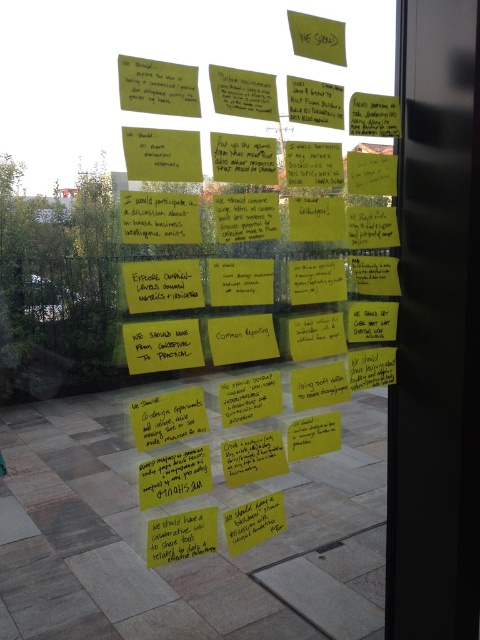
Question: Which point appears closest to the camera in this image?

Choices:
 (A) (410, 324)
 (B) (310, 228)

Answer: (B)

Question: Is yellow sticky notes at upper center above yellow sticky notes at right?

Choices:
 (A) no
 (B) yes

Answer: (B)

Question: Is yellow sticky notes at upper center further to the viewer compared to yellow sticky notes at right?

Choices:
 (A) yes
 (B) no

Answer: (B)

Question: Is yellow sticky notes at upper center below yellow sticky notes at right?

Choices:
 (A) yes
 (B) no

Answer: (B)